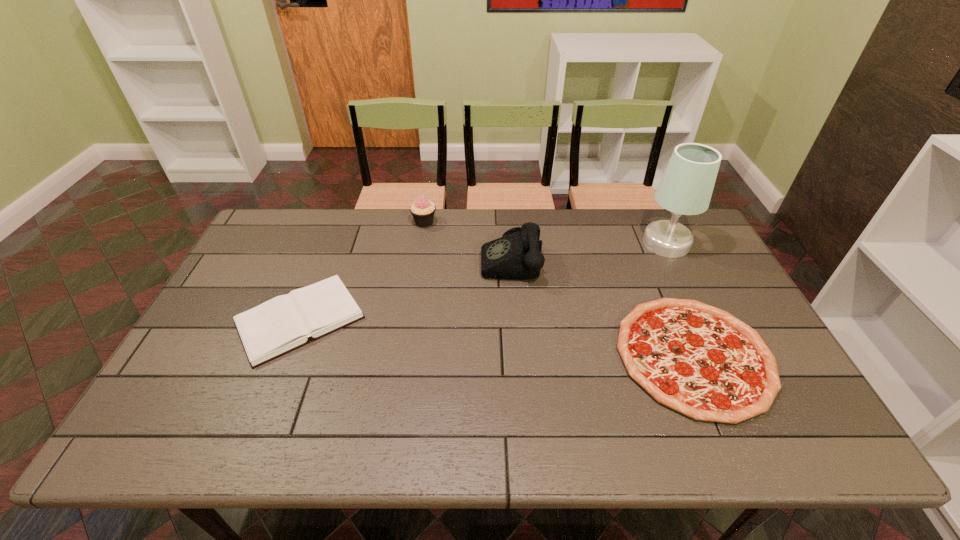
In order to click on free spot between the cupcake and the leftmost object in this screenshot , I will do `click(362, 271)`.

At what (x,y) coordinates should I click in order to perform the action: click on free space between the lampshade and the cupcake. Please return your answer as a coordinate pair (x, y). Looking at the image, I should click on (545, 233).

The image size is (960, 540). I want to click on vacant area that lies between the leftmost object and the tallest object, so click(483, 281).

The image size is (960, 540). Identify the location of free space between the lampshade and the cupcake. (545, 233).

Locate an element on the screen. This screenshot has height=540, width=960. vacant point located between the second object from left to right and the third object from right to left is located at coordinates (468, 240).

Where is `free space between the cupcake and the tallest object`? This screenshot has height=540, width=960. free space between the cupcake and the tallest object is located at coordinates (545, 233).

Select which object is the closest to the third object from left to right. Please provide its 2D coordinates. Your answer should be formatted as a tuple, i.e. [(x, y)], where the tuple contains the x and y coordinates of a point satisfying the conditions above.

[(422, 210)]

Identify which object is the nearest to the shortest object. Please provide its 2D coordinates. Your answer should be formatted as a tuple, i.e. [(x, y)], where the tuple contains the x and y coordinates of a point satisfying the conditions above.

[(517, 255)]

The width and height of the screenshot is (960, 540). I want to click on free point that satisfies the following two spatial constraints: 1. on the dial of the third object from right to left; 2. on the front side of the hardback book, so click(515, 320).

Locate an element on the screen. free region that satisfies the following two spatial constraints: 1. on the dial of the telephone; 2. on the front side of the fourth tallest object is located at coordinates (515, 320).